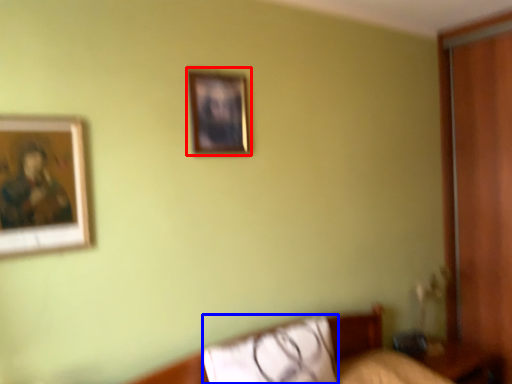
Question: Which point is closer to the camera, picture frame (highlighted by a red box) or pillow (highlighted by a blue box)?

Choices:
 (A) picture frame
 (B) pillow

Answer: (B)